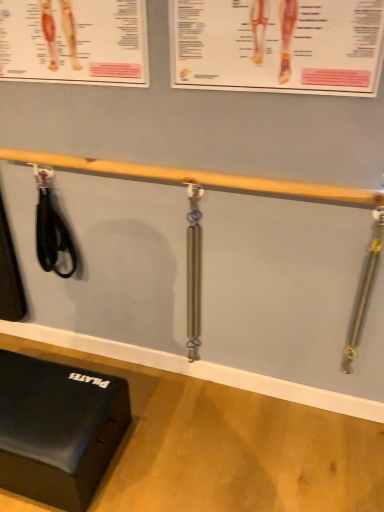
You are a GUI agent. You are given a task and a screenshot of the screen. Output one action in this format:
    pyautogui.click(x=<x>, y=<y>)
    Task: Click on the vacant point above black rubber exercise mat at lower left (from a real-world perspective)
    Image resolution: width=384 pixels, height=512 pixels.
    Given the screenshot: What is the action you would take?
    pyautogui.click(x=50, y=398)